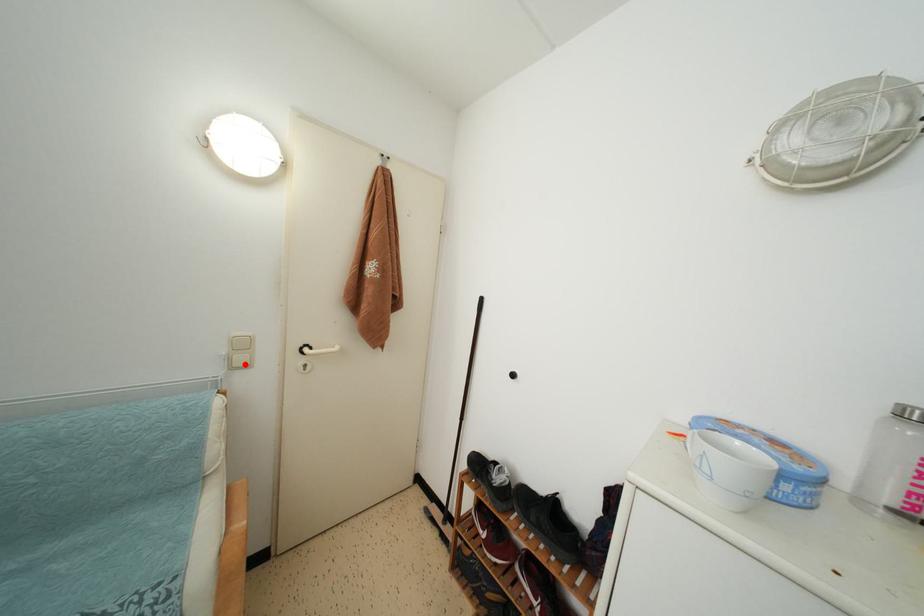
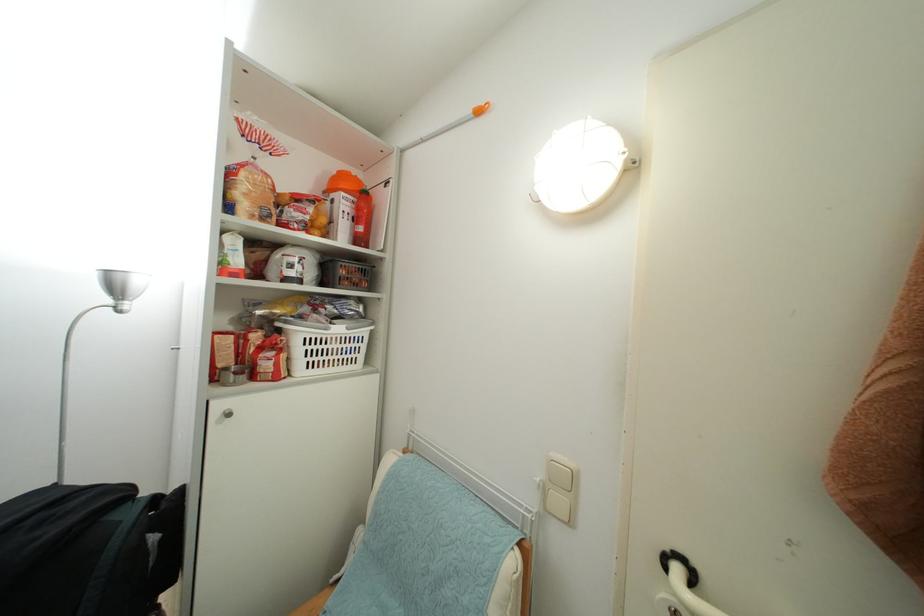
The point at the highlighted location is marked in the first image. Where is the corresponding point in the second image?

(563, 507)